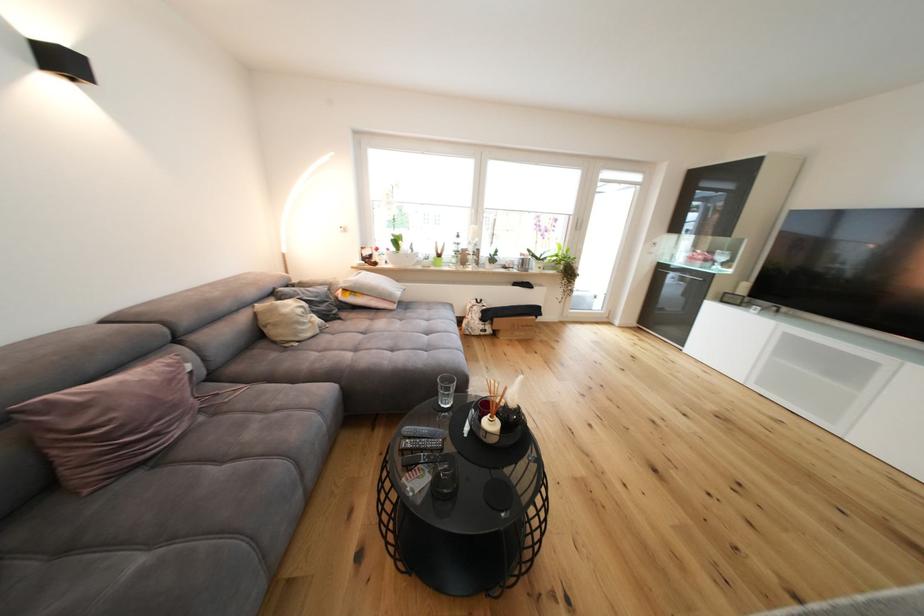
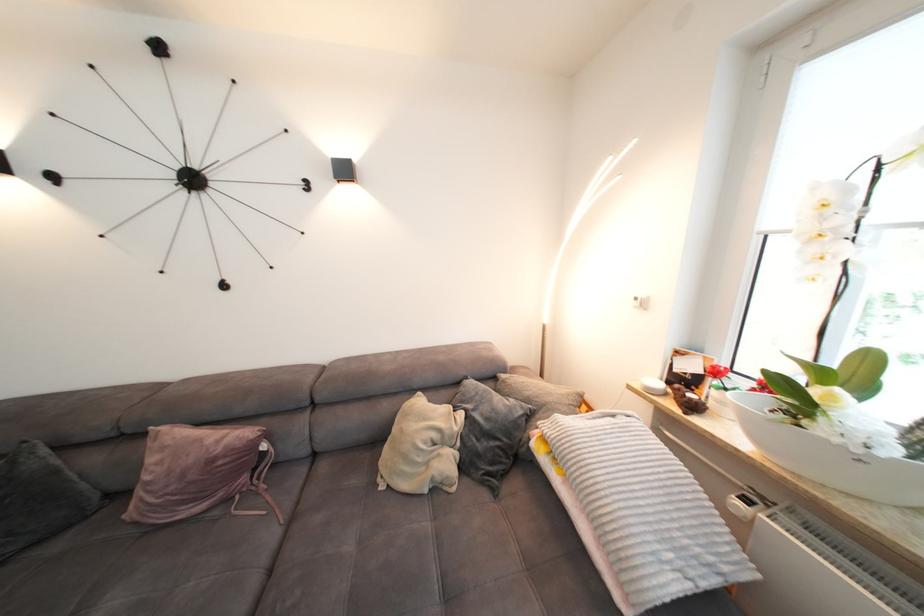
The point at [244,370] is marked in the first image. Where is the corresponding point in the second image?

(330, 469)